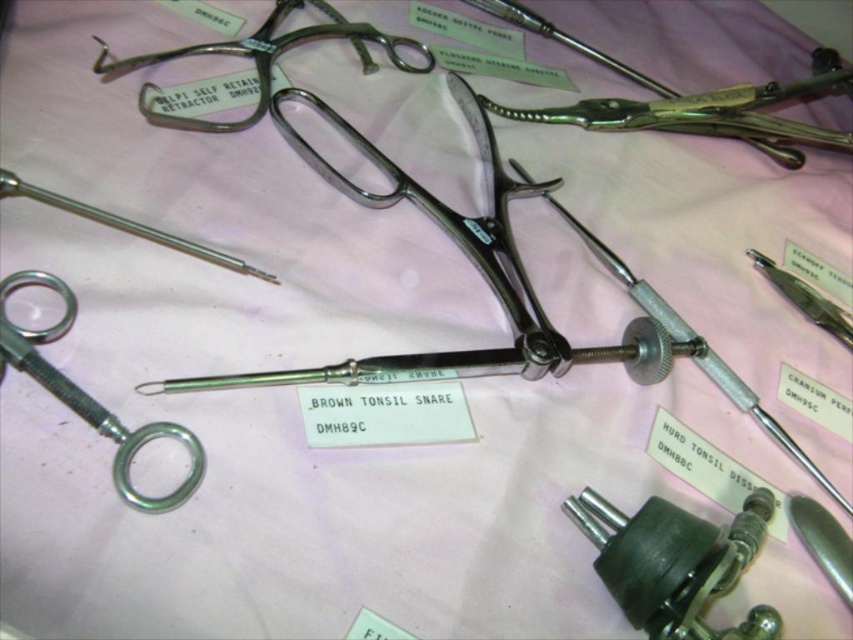
Question: Can you confirm if satin silver scissors at lower left is positioned above polished metal needle at center?

Choices:
 (A) yes
 (B) no

Answer: (B)

Question: Can you confirm if metallic silver screw at lower right is positioned below satin silver scissors at lower left?

Choices:
 (A) yes
 (B) no

Answer: (A)

Question: Among these points, which one is farthest from the camera?

Choices:
 (A) (67, 205)
 (B) (299, 8)
 (C) (850, 324)
 (D) (614, 547)

Answer: (B)

Question: Based on their relative distances, which object is nearer to the satin silver scissors at lower left?

Choices:
 (A) metallic silver scissors at upper center
 (B) satin silver scalpel at upper right
 (C) polished metal needle at center

Answer: (C)

Question: Which point appears farthest from the camera in this image?

Choices:
 (A) (57, 291)
 (B) (215, 122)
 (C) (764, 502)

Answer: (B)

Question: Where is satin silver scissors at lower left located in relation to polished metal needle at center in the image?

Choices:
 (A) right
 (B) left

Answer: (B)